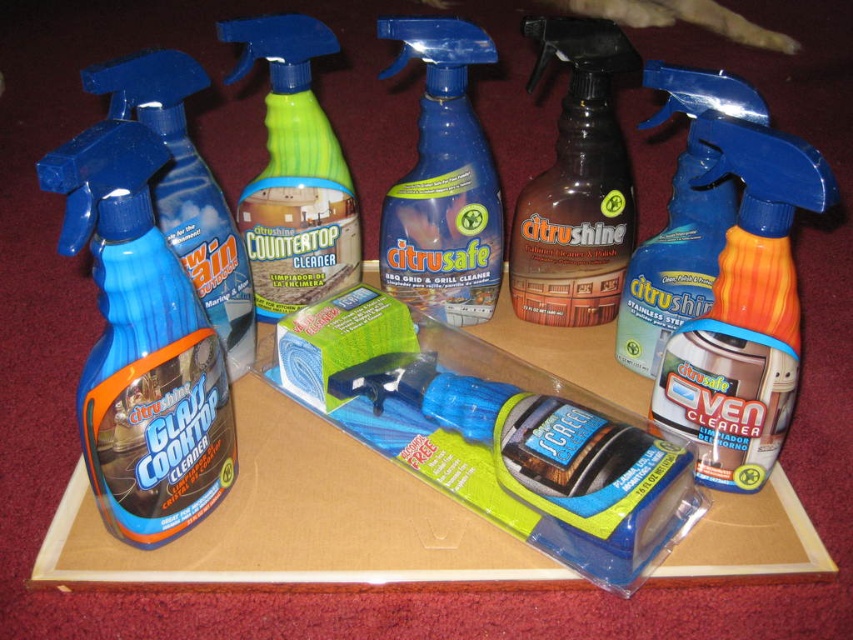
Does blue plastic oven cleaner at center right have a greater width compared to matte plastic glass cleaner at left?

Correct, the width of blue plastic oven cleaner at center right exceeds that of matte plastic glass cleaner at left.

How far apart are blue plastic oven cleaner at center right and matte plastic glass cleaner at left?

The distance of blue plastic oven cleaner at center right from matte plastic glass cleaner at left is 21.61 inches.

I want to click on blue plastic oven cleaner at center right, so 735,276.

Where is `blue plastic oven cleaner at center right`? The image size is (853, 640). blue plastic oven cleaner at center right is located at coordinates coord(735,276).

Does blue plastic spray bottle at left have a larger size compared to blue plastic spray bottle at center?

No.

Which is behind, point (201, 451) or point (412, 237)?

The point (412, 237) is behind.

Identify the location of blue plastic spray bottle at left. This screenshot has width=853, height=640. (141, 346).

This screenshot has width=853, height=640. Describe the element at coordinates (735, 276) in the screenshot. I see `blue plastic oven cleaner at center right` at that location.

Is blue plastic oven cleaner at center right wider than brown matte cleaner at center?

In fact, blue plastic oven cleaner at center right might be narrower than brown matte cleaner at center.

Is point (704, 234) farther from viewer compared to point (553, 268)?

That is False.

Where is `blue plastic oven cleaner at center right`? blue plastic oven cleaner at center right is located at coordinates (735, 276).